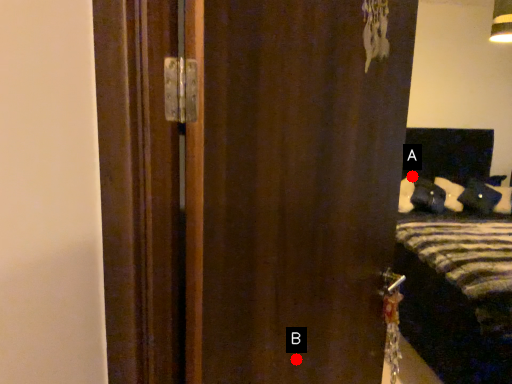
Question: Two points are circled on the image, labeled by A and B beside each circle. Among these points, which one is nearest to the camera?

Choices:
 (A) A is closer
 (B) B is closer

Answer: (B)